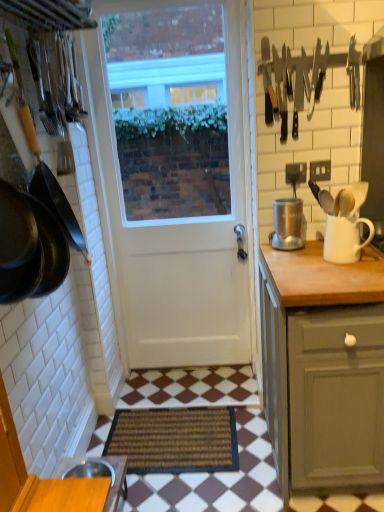
Question: From a real-world perspective, is white matte door at center physically below stainless steel knives at upper right?

Choices:
 (A) yes
 (B) no

Answer: (A)

Question: Is white matte door at center facing away from stainless steel knives at upper right?

Choices:
 (A) no
 (B) yes

Answer: (A)

Question: Can you confirm if white matte door at center is smaller than stainless steel knives at upper right?

Choices:
 (A) no
 (B) yes

Answer: (A)

Question: Is white matte door at center not close to stainless steel knives at upper right?

Choices:
 (A) no
 (B) yes

Answer: (A)

Question: Can you confirm if white matte door at center is taller than stainless steel knives at upper right?

Choices:
 (A) yes
 (B) no

Answer: (A)

Question: Is white matte door at center at the right side of stainless steel knives at upper right?

Choices:
 (A) no
 (B) yes

Answer: (A)

Question: Could brown woven mat at center be considered to be inside matte gray cabinet at right?

Choices:
 (A) no
 (B) yes

Answer: (A)

Question: Does matte gray cabinet at right have a larger size compared to brown woven mat at center?

Choices:
 (A) no
 (B) yes

Answer: (B)

Question: Considering the relative sizes of matte gray cabinet at right and brown woven mat at center in the image provided, is matte gray cabinet at right taller than brown woven mat at center?

Choices:
 (A) no
 (B) yes

Answer: (B)

Question: From the image's perspective, is matte gray cabinet at right located beneath brown woven mat at center?

Choices:
 (A) no
 (B) yes

Answer: (A)

Question: From the image's perspective, is matte gray cabinet at right above brown woven mat at center?

Choices:
 (A) yes
 (B) no

Answer: (A)

Question: Can you confirm if matte gray cabinet at right is smaller than brown woven mat at center?

Choices:
 (A) yes
 (B) no

Answer: (B)

Question: From the image's perspective, is wooden table at lower left located beneath silver metallic coffee grinder at right?

Choices:
 (A) no
 (B) yes

Answer: (B)